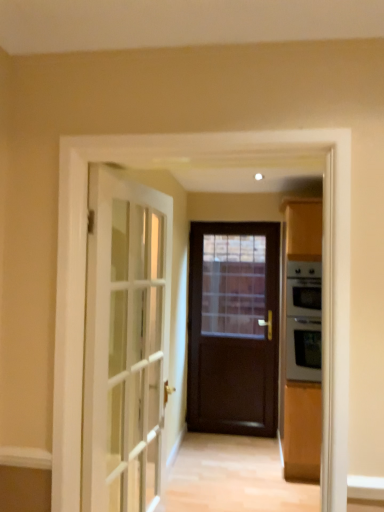
Question: Does silver metallic oven at right have a greater width compared to white glass door at left, which is the second door in back-to-front order?

Choices:
 (A) no
 (B) yes

Answer: (B)

Question: Is silver metallic oven at right at the right side of white glass door at left, the first door positioned from the front?

Choices:
 (A) yes
 (B) no

Answer: (A)

Question: From the image's perspective, is silver metallic oven at right on white glass door at left, which is the second door in back-to-front order?

Choices:
 (A) yes
 (B) no

Answer: (B)

Question: Can you confirm if silver metallic oven at right is positioned to the left of white glass door at left, placed as the second door when sorted from right to left?

Choices:
 (A) yes
 (B) no

Answer: (B)

Question: Does silver metallic oven at right come behind white glass door at left, which is the second door in back-to-front order?

Choices:
 (A) yes
 (B) no

Answer: (A)

Question: From the image's perspective, relative to silver metallic oven at right, is dark wood door at center, which is counted as the 2th door, starting from the left, above or below?

Choices:
 (A) above
 (B) below

Answer: (B)

Question: Is dark wood door at center, positioned as the second door in front-to-back order, bigger or smaller than silver metallic oven at right?

Choices:
 (A) big
 (B) small

Answer: (B)

Question: Is dark wood door at center, which is counted as the 2th door, starting from the left, taller or shorter than silver metallic oven at right?

Choices:
 (A) tall
 (B) short

Answer: (A)

Question: Is point (192, 381) closer or farther from the camera than point (311, 372)?

Choices:
 (A) farther
 (B) closer

Answer: (A)

Question: From a real-world perspective, is dark wood door at center, the first door in the back-to-front sequence, physically located above or below white glass door at left, the first door positioned from the front?

Choices:
 (A) below
 (B) above

Answer: (A)

Question: Is dark wood door at center, which is counted as the 2th door, starting from the left, situated inside white glass door at left, which is the 1th door from left to right, or outside?

Choices:
 (A) outside
 (B) inside

Answer: (A)

Question: Relative to white glass door at left, which is the 1th door from left to right, is dark wood door at center, which is counted as the 2th door, starting from the left, in front or behind?

Choices:
 (A) front
 (B) behind

Answer: (B)

Question: In terms of height, does dark wood door at center, which ranks as the first door in right-to-left order, look taller or shorter compared to white glass door at left, the first door positioned from the front?

Choices:
 (A) tall
 (B) short

Answer: (A)

Question: Is point tap(306, 345) closer or farther from the camera than point tap(125, 183)?

Choices:
 (A) closer
 (B) farther

Answer: (B)

Question: Would you say silver metallic oven at right is to the left or to the right of white glass door at left, the first door positioned from the front, in the picture?

Choices:
 (A) right
 (B) left

Answer: (A)